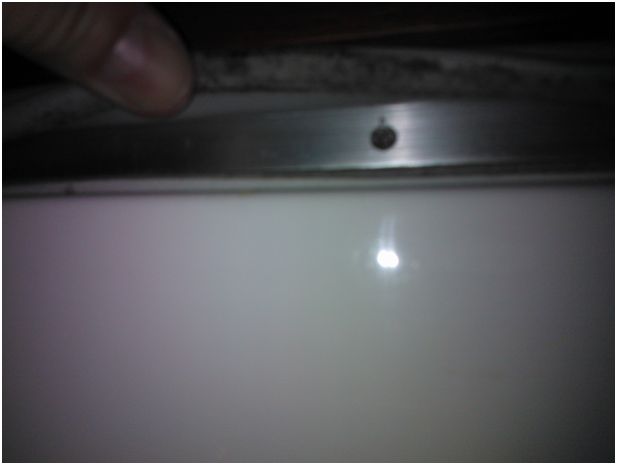
Identify the location of ceramic. (257, 251).